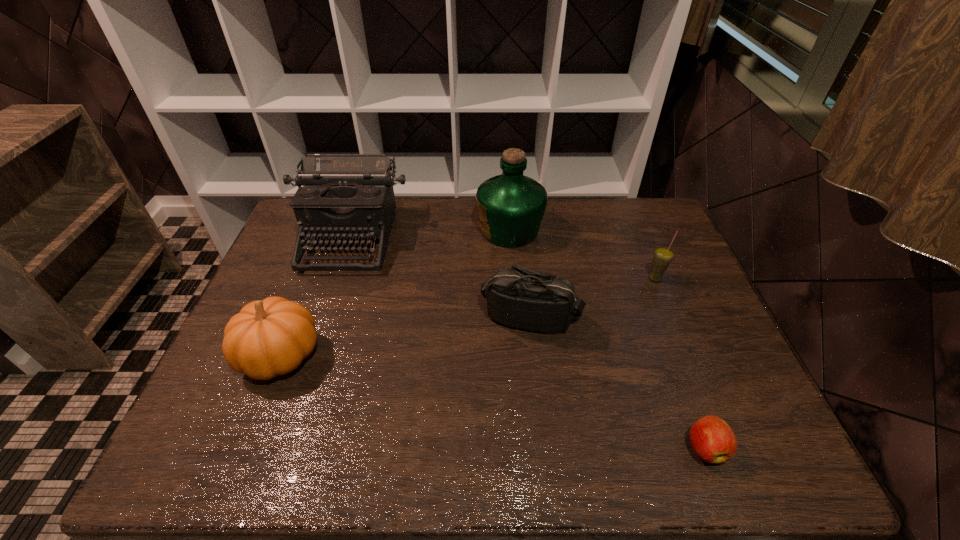
Where is `object identified as the closest to the tallest object`? object identified as the closest to the tallest object is located at coordinates (518, 297).

Find the location of `blank area in the image that satisfies the following two spatial constraints: 1. on the label side of the liquor; 2. on the right side of the straw for drinking`. blank area in the image that satisfies the following two spatial constraints: 1. on the label side of the liquor; 2. on the right side of the straw for drinking is located at coordinates (514, 279).

Identify the location of vacant space that satisfies the following two spatial constraints: 1. on the typing side of the nearest object; 2. on the left side of the typewriter. (280, 448).

This screenshot has height=540, width=960. In order to click on free space that satisfies the following two spatial constraints: 1. on the front side of the shortest object; 2. on the left side of the pumpkin in this screenshot , I will do `click(246, 448)`.

Locate an element on the screen. The image size is (960, 540). free spot that satisfies the following two spatial constraints: 1. on the typing side of the typewriter; 2. on the left side of the straw for drinking is located at coordinates (337, 279).

Identify the location of vacant point that satisfies the following two spatial constraints: 1. on the label side of the tallest object; 2. on the typing side of the typewriter. (510, 238).

Locate an element on the screen. vacant position in the image that satisfies the following two spatial constraints: 1. on the typing side of the typewriter; 2. on the left side of the shortest object is located at coordinates (280, 448).